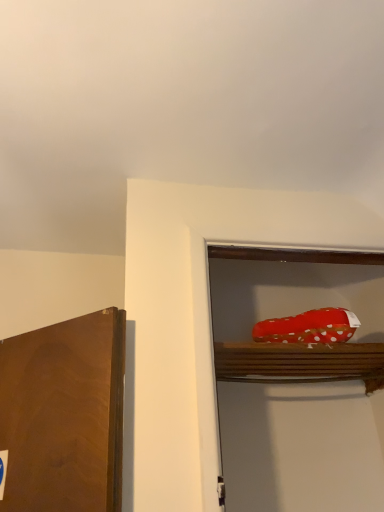
Question: Does polka dot fabric shoe at upper right appear on the right side of red polka dot fabric at upper right?

Choices:
 (A) yes
 (B) no

Answer: (A)

Question: Is polka dot fabric shoe at upper right to the left of red polka dot fabric at upper right from the viewer's perspective?

Choices:
 (A) yes
 (B) no

Answer: (B)

Question: Is the position of polka dot fabric shoe at upper right less distant than that of red polka dot fabric at upper right?

Choices:
 (A) no
 (B) yes

Answer: (B)

Question: Does polka dot fabric shoe at upper right have a larger size compared to red polka dot fabric at upper right?

Choices:
 (A) yes
 (B) no

Answer: (A)

Question: From a real-world perspective, is polka dot fabric shoe at upper right under red polka dot fabric at upper right?

Choices:
 (A) yes
 (B) no

Answer: (A)

Question: From the image's perspective, would you say polka dot fabric shoe at upper right is shown under red polka dot fabric at upper right?

Choices:
 (A) no
 (B) yes

Answer: (B)

Question: Is red polka dot fabric at upper right outside polka dot fabric shoe at upper right?

Choices:
 (A) no
 (B) yes

Answer: (B)

Question: Is red polka dot fabric at upper right at the left side of polka dot fabric shoe at upper right?

Choices:
 (A) yes
 (B) no

Answer: (A)

Question: Is red polka dot fabric at upper right at the right side of polka dot fabric shoe at upper right?

Choices:
 (A) yes
 (B) no

Answer: (B)

Question: Is red polka dot fabric at upper right next to polka dot fabric shoe at upper right and touching it?

Choices:
 (A) no
 (B) yes

Answer: (A)

Question: Does red polka dot fabric at upper right have a greater height compared to polka dot fabric shoe at upper right?

Choices:
 (A) no
 (B) yes

Answer: (A)

Question: Is red polka dot fabric at upper right smaller than polka dot fabric shoe at upper right?

Choices:
 (A) yes
 (B) no

Answer: (A)

Question: Which is correct: polka dot fabric shoe at upper right is inside red polka dot fabric at upper right, or outside of it?

Choices:
 (A) inside
 (B) outside

Answer: (B)